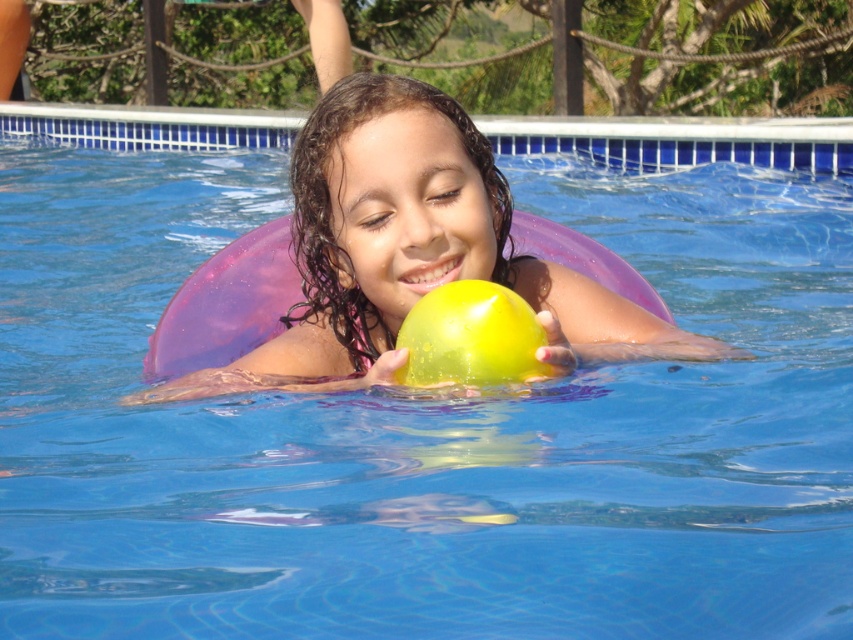
Question: Can you confirm if yellow rubber ball at center is positioned to the left of translucent yellow ball at center?

Choices:
 (A) no
 (B) yes

Answer: (B)

Question: Observing the image, what is the correct spatial positioning of yellow rubber ball at center in reference to translucent yellow ball at center?

Choices:
 (A) right
 (B) left

Answer: (B)

Question: Does yellow rubber ball at center come in front of translucent yellow ball at center?

Choices:
 (A) yes
 (B) no

Answer: (B)